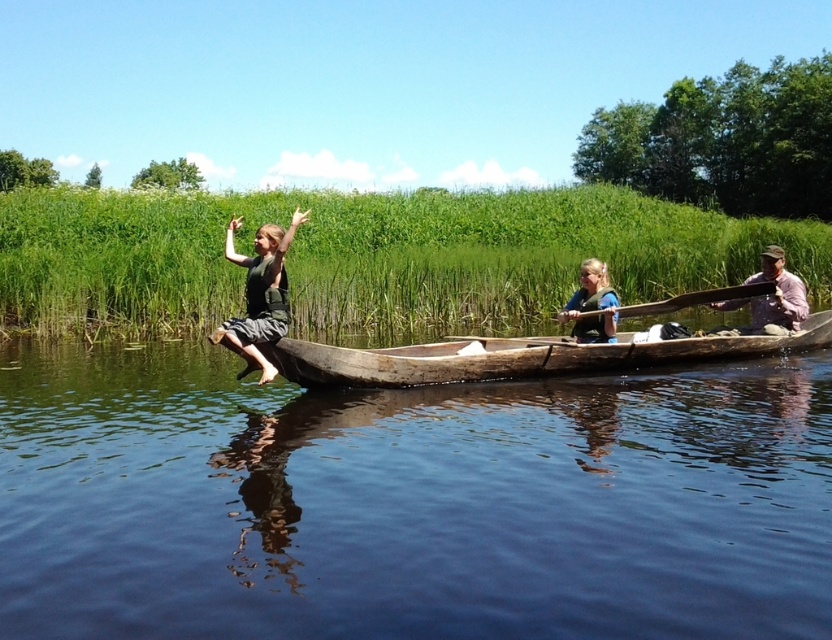
Does green fabric person at left have a lesser height compared to light brown wooden paddle at right?

No.

Who is lower down, green fabric person at left or light brown wooden paddle at right?

light brown wooden paddle at right

What do you see at coordinates (260, 294) in the screenshot? The image size is (832, 640). I see `green fabric person at left` at bounding box center [260, 294].

Where is `green fabric person at left`? The image size is (832, 640). green fabric person at left is located at coordinates point(260,294).

Where is `transparent water at boat front`? This screenshot has height=640, width=832. transparent water at boat front is located at coordinates (409, 500).

What do you see at coordinates (409, 500) in the screenshot? I see `transparent water at boat front` at bounding box center [409, 500].

Who is more forward, (171, 397) or (575, 332)?

Point (171, 397)

Identify the location of transparent water at boat front. This screenshot has height=640, width=832. (409, 500).

Between wooden canoe at center and light brown wooden paddle at right, which one has more height?

light brown wooden paddle at right

Who is more distant from viewer, (317, 365) or (776, 276)?

Positioned behind is point (776, 276).

This screenshot has height=640, width=832. Identify the location of wooden canoe at center. (518, 356).